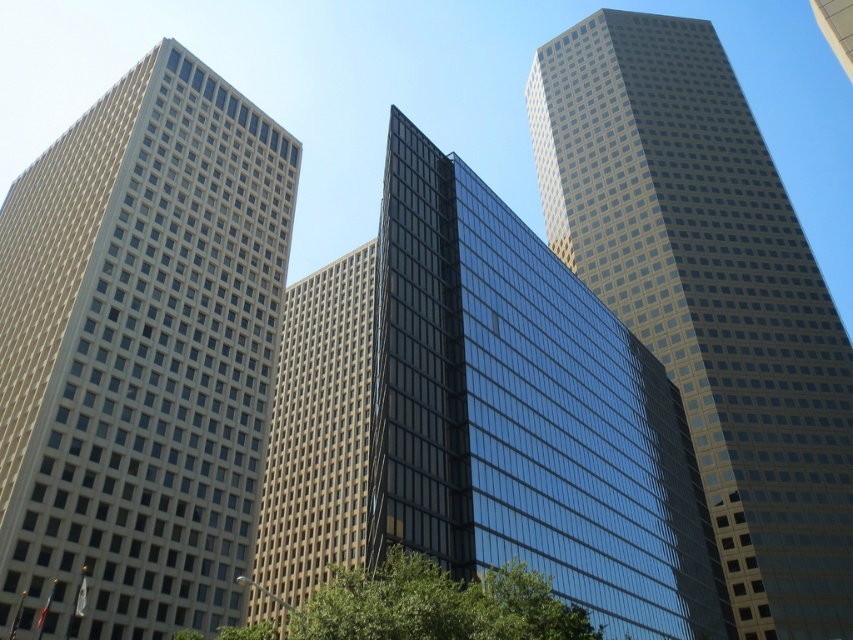
Is glassy reflective skyscraper at center to the left of matte glass skyscraper at upper right from the viewer's perspective?

Correct, you'll find glassy reflective skyscraper at center to the left of matte glass skyscraper at upper right.

Could you measure the distance between glassy reflective skyscraper at center and matte glass skyscraper at upper right?

glassy reflective skyscraper at center is 139.14 feet from matte glass skyscraper at upper right.

Who is more forward, (521, 257) or (767, 333)?

Point (521, 257)

In order to click on glassy reflective skyscraper at center in this screenshot , I will do `click(488, 419)`.

In the scene shown: Between matte glass skyscraper at upper right and green leafy tree at lower center, which one has more height?

matte glass skyscraper at upper right

Is point (801, 484) closer to viewer compared to point (540, 621)?

No, (801, 484) is behind (540, 621).

Does point (780, 589) lie in front of point (320, 616)?

No, it is not.

This screenshot has width=853, height=640. I want to click on matte glass skyscraper at upper right, so pos(708,296).

Is beige glass building at left to the right of matte glass skyscraper at upper right from the viewer's perspective?

Incorrect, beige glass building at left is not on the right side of matte glass skyscraper at upper right.

Can you confirm if beige glass building at left is shorter than matte glass skyscraper at upper right?

Indeed, beige glass building at left has a lesser height compared to matte glass skyscraper at upper right.

Does point (141, 157) lie behind point (808, 360)?

No, (141, 157) is closer to viewer.

At what (x,y) coordinates should I click in order to perform the action: click on beige glass building at left. Please return your answer as a coordinate pair (x, y). Looking at the image, I should click on (138, 355).